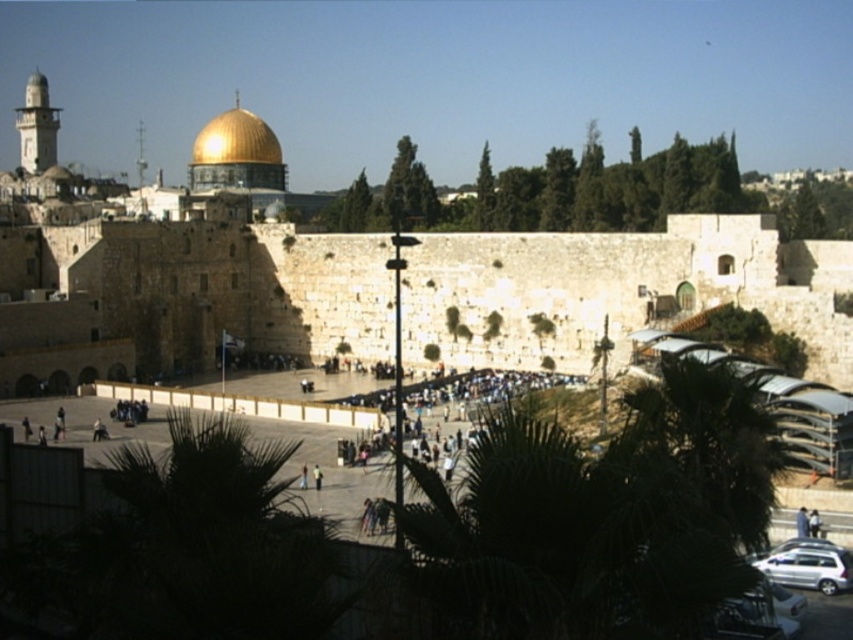
Question: Which point is farther to the camera?

Choices:
 (A) green leafy palm tree at lower left
 (B) gold shiny dome at upper center

Answer: (B)

Question: Does green leafy palm tree at lower left appear on the left side of gold shiny dome at upper center?

Choices:
 (A) yes
 (B) no

Answer: (B)

Question: Among these points, which one is nearest to the camera?

Choices:
 (A) (267, 148)
 (B) (138, 552)

Answer: (B)

Question: Can you confirm if green leafy palm tree at lower left is bigger than gold shiny dome at upper center?

Choices:
 (A) yes
 (B) no

Answer: (B)

Question: Does green leafy palm tree at lower left appear on the left side of gold shiny dome at upper center?

Choices:
 (A) yes
 (B) no

Answer: (B)